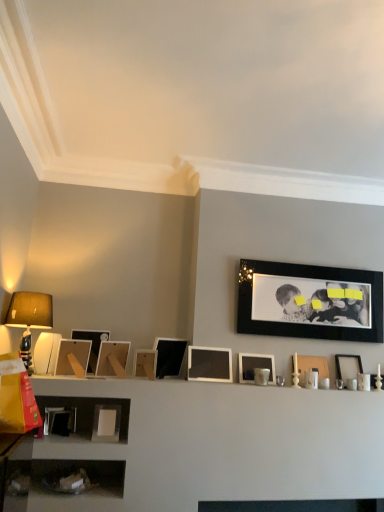
Question: Which direction should I rotate to look at wooden at center, which is the 5th picture frame from left to right, — up or down?

Choices:
 (A) up
 (B) down

Answer: (B)

Question: From a real-world perspective, does matte black lampshade at left sit lower than matte white picture frame at upper right, marked as the ninth picture frame in a left-to-right arrangement?

Choices:
 (A) no
 (B) yes

Answer: (A)

Question: Is matte black lampshade at left positioned before matte white picture frame at upper right, marked as the ninth picture frame in a left-to-right arrangement?

Choices:
 (A) yes
 (B) no

Answer: (A)

Question: Is matte black lampshade at left at the right side of matte white picture frame at upper right, positioned as the third picture frame in right-to-left order?

Choices:
 (A) yes
 (B) no

Answer: (B)

Question: Is matte black lampshade at left not near matte white picture frame at upper right, positioned as the third picture frame in right-to-left order?

Choices:
 (A) no
 (B) yes

Answer: (B)

Question: Is matte black lampshade at left further to camera compared to matte white picture frame at upper right, positioned as the third picture frame in right-to-left order?

Choices:
 (A) no
 (B) yes

Answer: (A)

Question: Is matte black lampshade at left surrounding matte white picture frame at upper right, positioned as the third picture frame in right-to-left order?

Choices:
 (A) no
 (B) yes

Answer: (A)

Question: Is white matte picture frame at lower left, positioned as the ninth picture frame in right-to-left order, facing towards matte white picture frame at upper right, marked as the ninth picture frame in a left-to-right arrangement?

Choices:
 (A) no
 (B) yes

Answer: (A)

Question: Can you see white matte picture frame at lower left, positioned as the ninth picture frame in right-to-left order, touching matte white picture frame at upper right, positioned as the third picture frame in right-to-left order?

Choices:
 (A) yes
 (B) no

Answer: (B)

Question: Considering the relative sizes of white matte picture frame at lower left, positioned as the ninth picture frame in right-to-left order, and matte white picture frame at upper right, positioned as the third picture frame in right-to-left order, in the image provided, is white matte picture frame at lower left, positioned as the ninth picture frame in right-to-left order, smaller than matte white picture frame at upper right, positioned as the third picture frame in right-to-left order,?

Choices:
 (A) no
 (B) yes

Answer: (B)

Question: Is matte white picture frame at upper right, marked as the ninth picture frame in a left-to-right arrangement, surrounded by white matte picture frame at lower left, positioned as the ninth picture frame in right-to-left order?

Choices:
 (A) no
 (B) yes

Answer: (A)

Question: From the image's perspective, would you say white matte picture frame at lower left, positioned as the ninth picture frame in right-to-left order, is positioned over matte white picture frame at upper right, marked as the ninth picture frame in a left-to-right arrangement?

Choices:
 (A) yes
 (B) no

Answer: (B)

Question: Does white matte picture frame at lower left, the third picture frame viewed from the left, lie in front of matte white picture frame at upper right, marked as the ninth picture frame in a left-to-right arrangement?

Choices:
 (A) no
 (B) yes

Answer: (B)

Question: Considering the relative sizes of matte wooden picture frame at left, which is counted as the second picture frame, starting from the left, and white matte picture frame at center, the 5th picture frame viewed from the right, in the image provided, is matte wooden picture frame at left, which is counted as the second picture frame, starting from the left, wider than white matte picture frame at center, the 5th picture frame viewed from the right,?

Choices:
 (A) yes
 (B) no

Answer: (A)